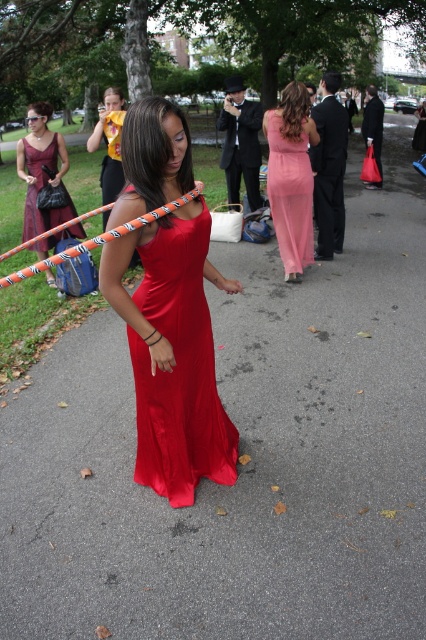
Is satin dress at center behind pink satin dress at upper center?

No, it is in front of pink satin dress at upper center.

Is satin dress at center shorter than pink satin dress at upper center?

Yes.

I want to click on satin dress at center, so click(x=178, y=369).

Identify the location of satin dress at center. This screenshot has width=426, height=640. (178, 369).

Which is above, satin dress at center or matte burgundy dress at center?

matte burgundy dress at center

Is point (195, 225) more distant than point (37, 140)?

No, it is in front of (37, 140).

The height and width of the screenshot is (640, 426). Identify the location of satin dress at center. (178, 369).

Who is positioned more to the right, satin dress at center or pink satin maxi dress at center?

pink satin maxi dress at center

Does satin dress at center have a greater height compared to pink satin maxi dress at center?

In fact, satin dress at center may be shorter than pink satin maxi dress at center.

Where is `satin dress at center`? satin dress at center is located at coordinates (178, 369).

Where is `satin dress at center`? The width and height of the screenshot is (426, 640). satin dress at center is located at coordinates (178, 369).